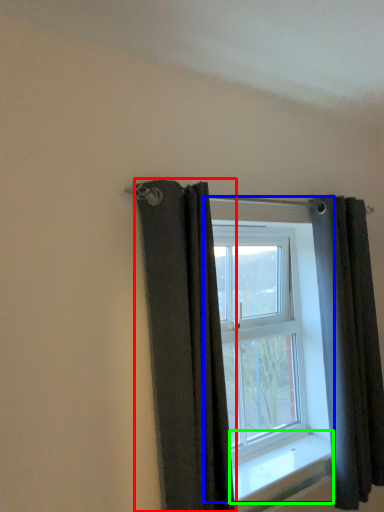
Question: Estimate the real-world distances between objects in this image. Which object is farther from curtain (highlighted by a red box), window (highlighted by a blue box) or window sill (highlighted by a green box)?

Choices:
 (A) window
 (B) window sill

Answer: (B)